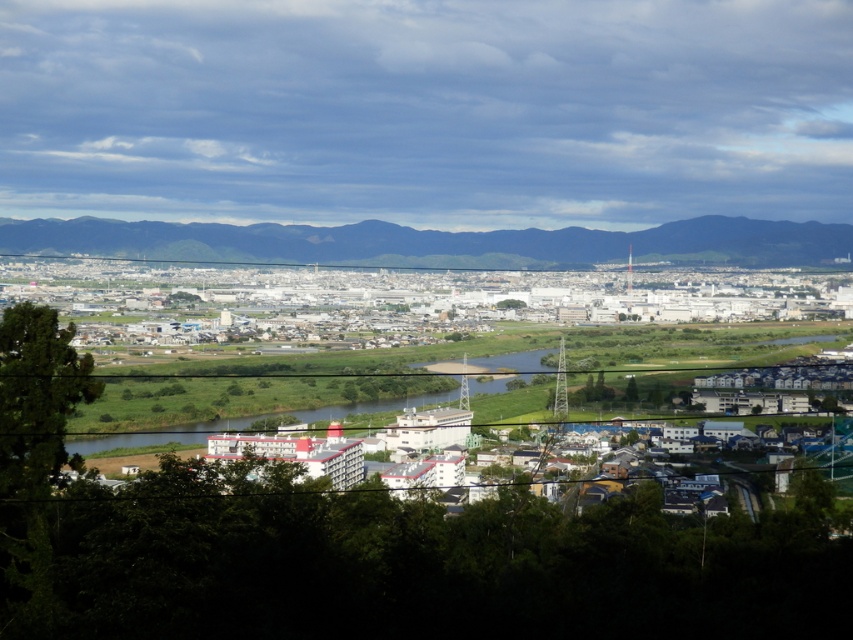
Question: Among these points, which one is nearest to the camera?

Choices:
 (A) (311, 234)
 (B) (489, 385)
 (C) (561, 316)

Answer: (B)

Question: In this image, where is white industrial buildings at center located relative to dark green forest at upper center?

Choices:
 (A) below
 (B) above

Answer: (A)

Question: Is white industrial buildings at center thinner than dark green forest at upper center?

Choices:
 (A) yes
 (B) no

Answer: (A)

Question: Based on their relative distances, which object is nearer to the dark green forest at upper center?

Choices:
 (A) white industrial buildings at center
 (B) green grassy river at center

Answer: (A)

Question: Is dark green forest at upper center below green grassy river at center?

Choices:
 (A) yes
 (B) no

Answer: (B)

Question: Which of the following is the closest to the observer?

Choices:
 (A) (511, 252)
 (B) (376, 401)

Answer: (B)